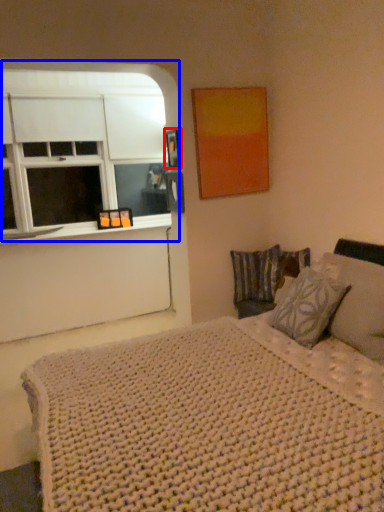
Question: Which object appears farthest to the camera in this image, picture frame (highlighted by a red box) or window (highlighted by a blue box)?

Choices:
 (A) picture frame
 (B) window

Answer: (B)